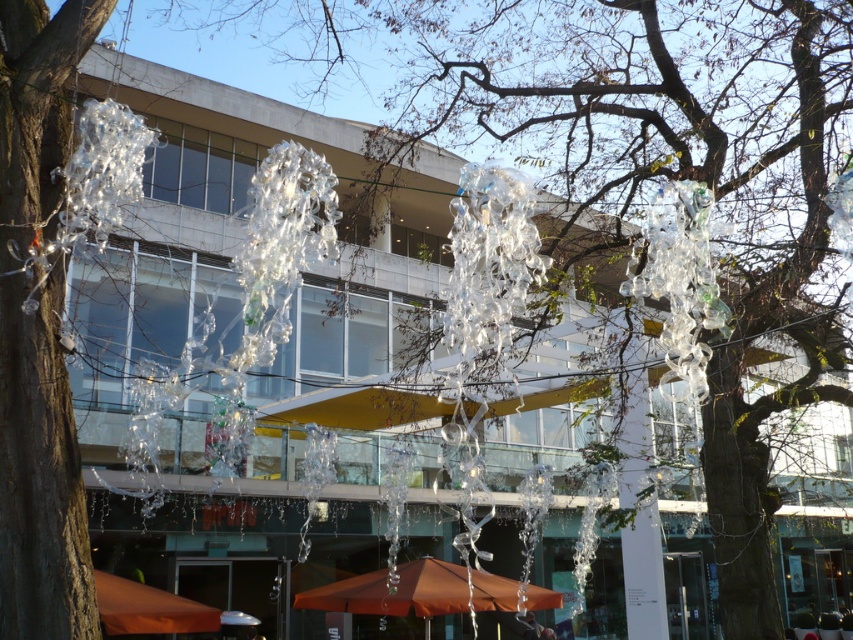
You are a customer looking for shade at the orange fabric umbrella at lower left. However, there is another orange fabric umbrella at center nearby. Which umbrella is blocking your view of the sky?

The orange fabric umbrella at center is positioned under the orange fabric umbrella at lower left, so the orange fabric umbrella at center is blocking your view of the sky.

You are standing in front of the modern building and want to take a photo. There are two points marked on the glass windows at coordinates point (293, 600) and point (149, 600). Which point is closer to your camera when taking the photo?

Point (149, 600) is closer to the camera because it is less further than point (293, 600) according to the description.